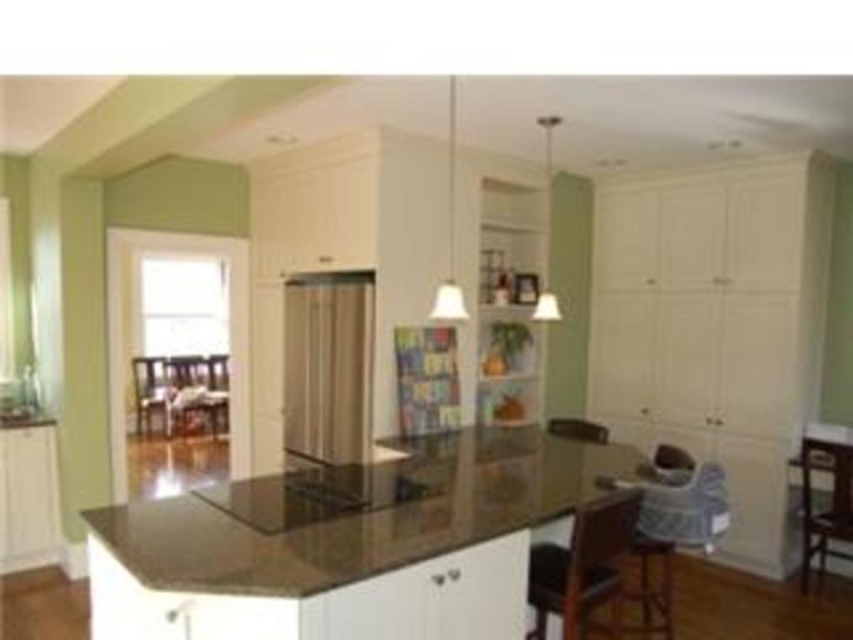
Question: Which of the following is the farthest from the observer?

Choices:
 (A) white matte cabinet at right
 (B) white glossy cabinet at lower left
 (C) matte black chair at left

Answer: (C)

Question: Is brown leather chair at lower right above matte black chair at left?

Choices:
 (A) yes
 (B) no

Answer: (B)

Question: Among these objects, which one is farthest from the camera?

Choices:
 (A) wooden chair at center
 (B) matte black chair at left

Answer: (A)

Question: Among these points, which one is nearest to the camera?

Choices:
 (A) (566, 424)
 (B) (819, 248)
 (C) (637, 580)
 (D) (355, 512)

Answer: (D)

Question: In this image, where is white matte cabinet at right located relative to brown leather chair at lower right?

Choices:
 (A) below
 (B) above

Answer: (B)

Question: Is white glossy cabinet at lower left to the left of wooden bar stool at lower right from the viewer's perspective?

Choices:
 (A) no
 (B) yes

Answer: (B)